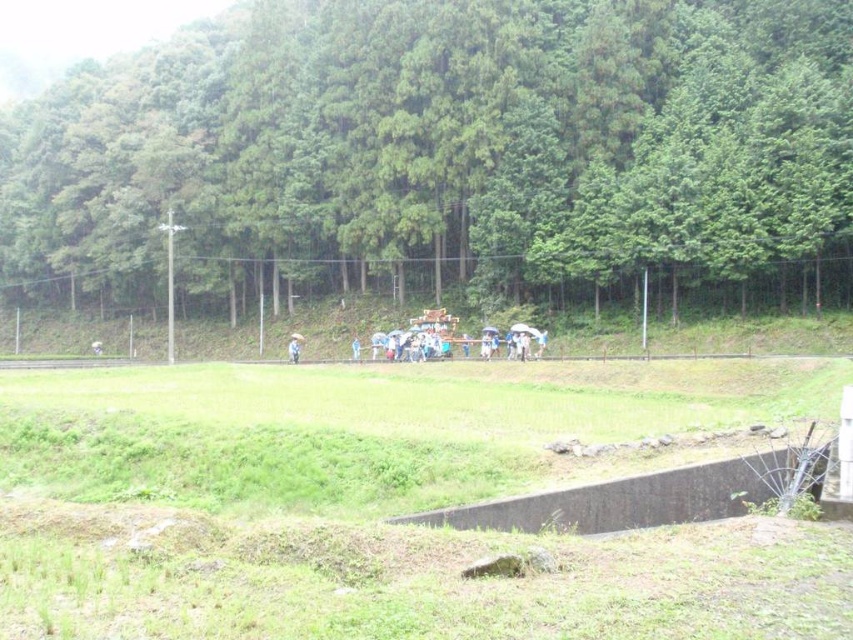
You are standing in the rural scene and want to determine which of the two points, point (399, 8) or point (289, 339), is nearer to your current position. Based on the scene description, which point is closer to you?

Point (399, 8) is closer to the camera than point (289, 339), so it is nearer to your current position.

You are a photographer trying to capture a clear shot of the blue fabric umbrella at center without the green leafy trees at upper center blocking it. Based on the scene, is this possible?

The green leafy trees at upper center are in front of the blue fabric umbrella at center, so they will block the view of the umbrella. Move to a position where the trees are not between you and the umbrella.

You are attending an outdoor event and see two umbrellas in the scene. Which one is positioned to the left of the other? The umbrellas are the white fabric umbrella at center and the blue fabric umbrella at center.

The white fabric umbrella at center is to the left of the blue fabric umbrella at center.